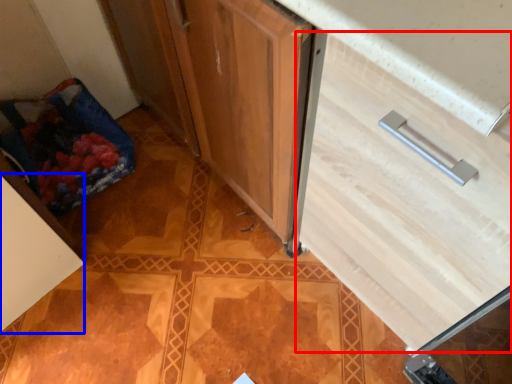
Question: Which point is further to the camera, drawer (highlighted by a red box) or cabinetry (highlighted by a blue box)?

Choices:
 (A) drawer
 (B) cabinetry

Answer: (B)